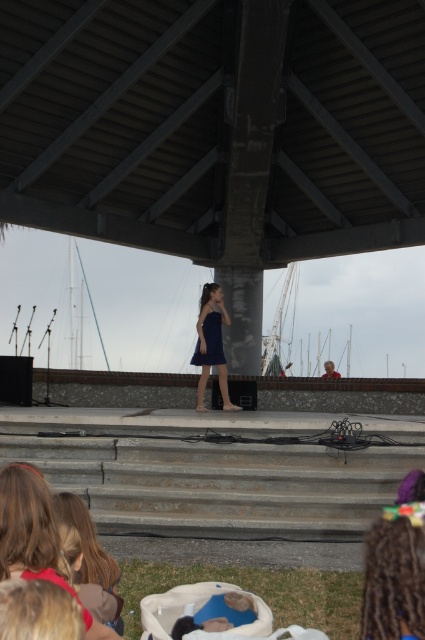
You are a photographer at the event and need to capture a clear photo of both the navy satin dress at center and the satin blue dress at center. Which dress should you focus on to ensure it appears larger in the photo?

The navy satin dress at center is much taller than the satin blue dress at center, so focusing on the navy satin dress at center will make it appear larger in the photo.

You are a photographer positioned at the camera. You want to capture a closeup shot of the navy satin dress at center. Given that the dress is 12 meters away, what adjustment should you make to your camera to achieve this closeup?

Since the navy satin dress at center is 12.00 meters away from the camera, you should use a telephoto lens to zoom in and capture a closeup of the dress despite the distance.

Consider the image. You are organizing a school play and need to determine which performer is wearing the correct costume based on size requirements. The navy satin dress at center and the satin blue dress at center are both present. According to the scene description, which dress is larger?

The navy satin dress at center is larger than the satin blue dress at center, so it meets the size requirement.